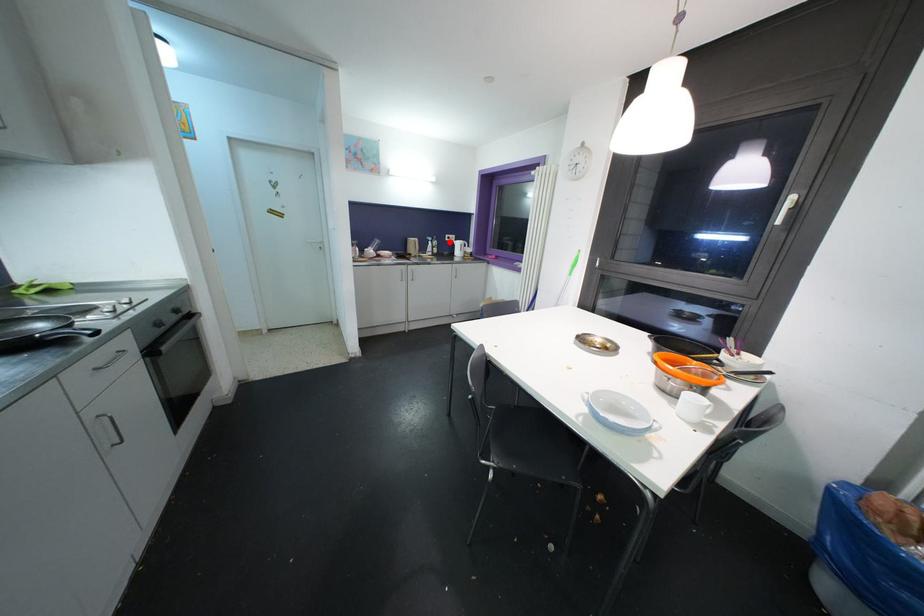
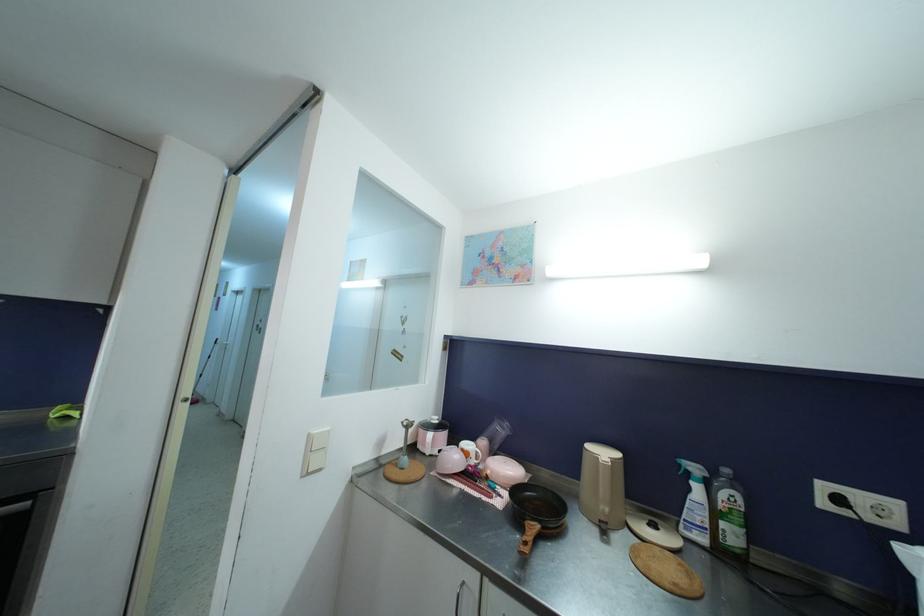
The point at the highlighted location is marked in the first image. Where is the corresponding point in the second image?

(827, 507)